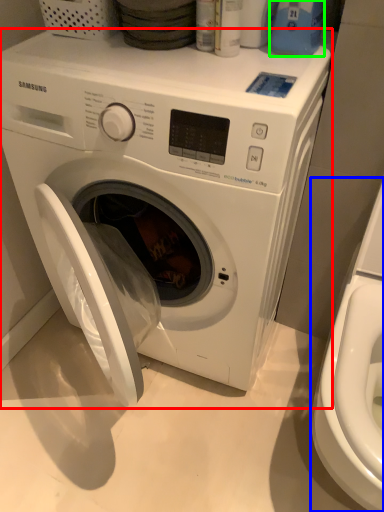
Question: Which is nearer to the washing machine (highlighted by a red box)? washer (highlighted by a blue box) or cleaning product (highlighted by a green box).

Choices:
 (A) washer
 (B) cleaning product

Answer: (A)